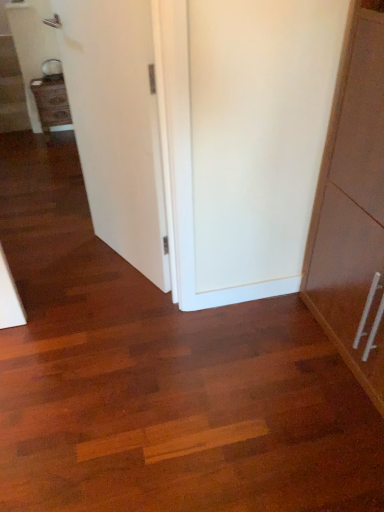
Where is `vacant space positioned to the left of matte wood cabinet at left`? The image size is (384, 512). vacant space positioned to the left of matte wood cabinet at left is located at coordinates (23, 140).